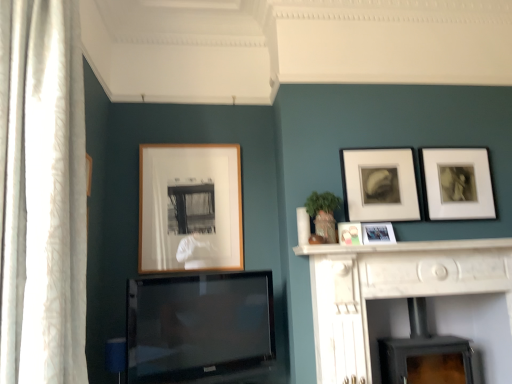
Question: From the image's perspective, is white marble fireplace at center located above or below matte black picture frame at upper right, placed as the fourth picture frame when sorted from left to right?

Choices:
 (A) above
 (B) below

Answer: (B)

Question: Do you think white marble fireplace at center is within matte black picture frame at upper right, placed as the fourth picture frame when sorted from left to right, or outside of it?

Choices:
 (A) outside
 (B) inside

Answer: (A)

Question: Which is farther from the flat-screen tv at center?

Choices:
 (A) white marble fireplace at center
 (B) white sheer curtain at left
 (C) matte black picture frame at upper right, the second picture frame in the right-to-left sequence
 (D) black matte wood burning stove at lower center
 (E) matte plastic picture frame at upper center, which ranks as the second picture frame in left-to-right order

Answer: (B)

Question: Estimate the real-world distances between objects in this image. Which object is farther from the white marble fireplace at center?

Choices:
 (A) metallic silver photo frame at center-right, positioned as the 3th picture frame in left-to-right order
 (B) white sheer curtain at left
 (C) black matte wood burning stove at lower center
 (D) matte black picture frame at upper right, which ranks as the 5th picture frame in left-to-right order
 (E) wooden frame at center, positioned as the fifth picture frame in right-to-left order

Answer: (B)